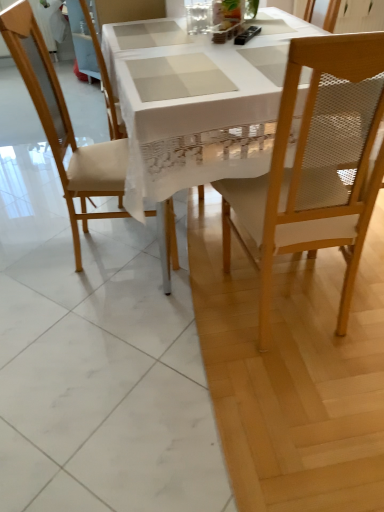
At what (x,y) coordinates should I click in order to perform the action: click on vacant space situated on the left part of matte wood chair at left, placed as the 3th chair when sorted from right to left. Please return your answer as a coordinate pair (x, y). Image resolution: width=384 pixels, height=512 pixels. Looking at the image, I should click on (38, 248).